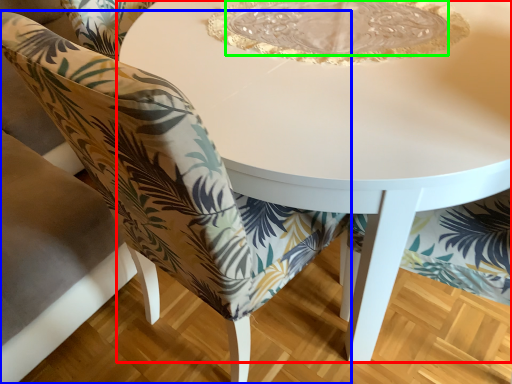
Question: Which object is positioned closest to table (highlighted by a red box)? Select from chair (highlighted by a blue box) and glass plate (highlighted by a green box).

Choices:
 (A) chair
 (B) glass plate

Answer: (B)